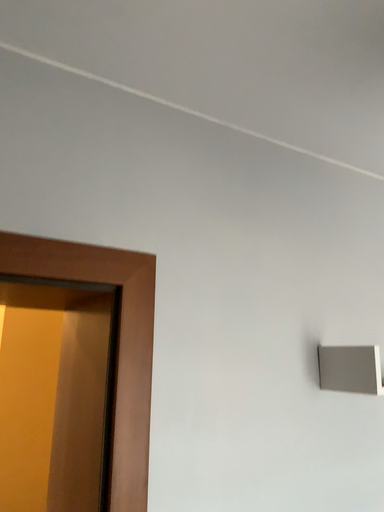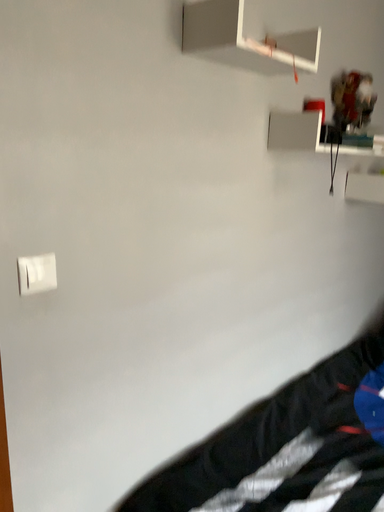
Question: Which way did the camera rotate in the video?

Choices:
 (A) rotated downward
 (B) rotated upward

Answer: (A)